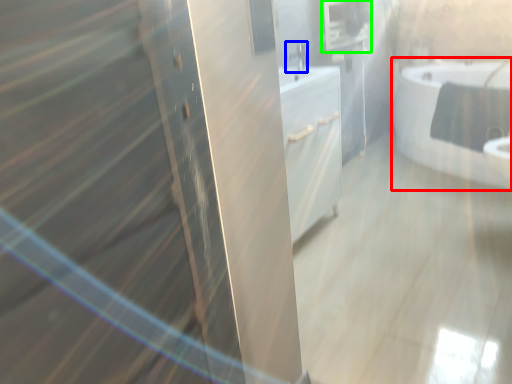
Question: Which is nearer to the bathtub (highlighted by a red box)? faucet (highlighted by a blue box) or medicine cabinet (highlighted by a green box).

Choices:
 (A) faucet
 (B) medicine cabinet

Answer: (B)